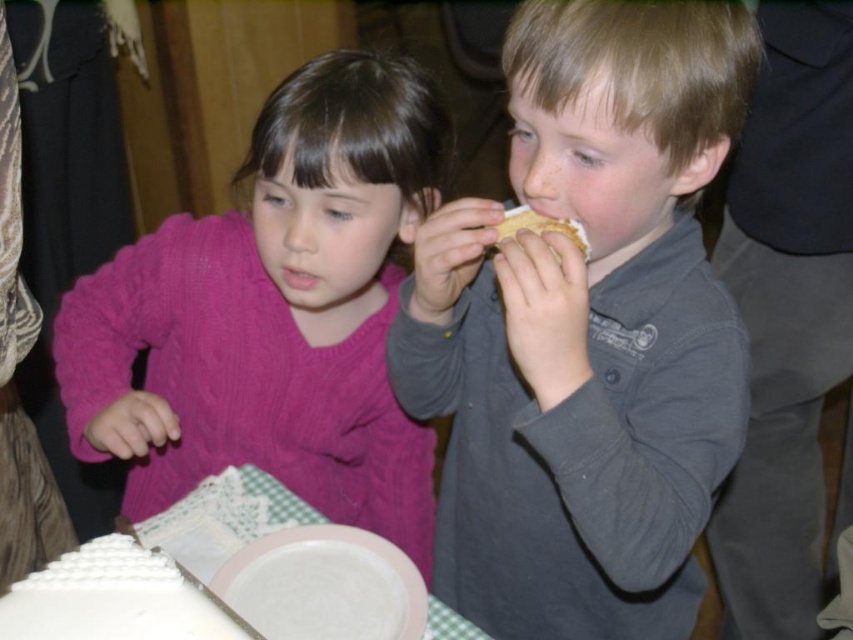
Question: Does white smooth cake at lower left appear over white frosted cake at lower left?

Choices:
 (A) yes
 (B) no

Answer: (A)

Question: Which point is closer to the camera?

Choices:
 (A) (102, 595)
 (B) (544, 564)

Answer: (A)

Question: Which point is farther from the camera taking this photo?

Choices:
 (A) (189, 541)
 (B) (114, 577)

Answer: (A)

Question: Does matte gray shirt at center appear over golden crumbly pie at upper center?

Choices:
 (A) no
 (B) yes

Answer: (A)

Question: Is matte gray shirt at center closer to camera compared to white smooth cake at lower left?

Choices:
 (A) yes
 (B) no

Answer: (B)

Question: Which object is closer to the camera taking this photo?

Choices:
 (A) golden crumbly pie at upper center
 (B) white smooth cake at lower left
 (C) pink knitted sweater at left
 (D) matte gray shirt at center

Answer: (B)